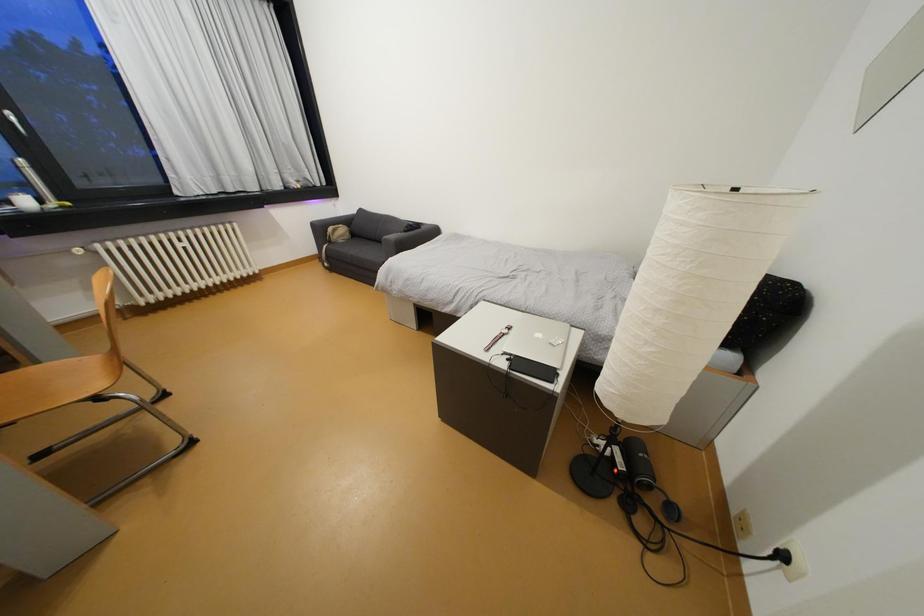
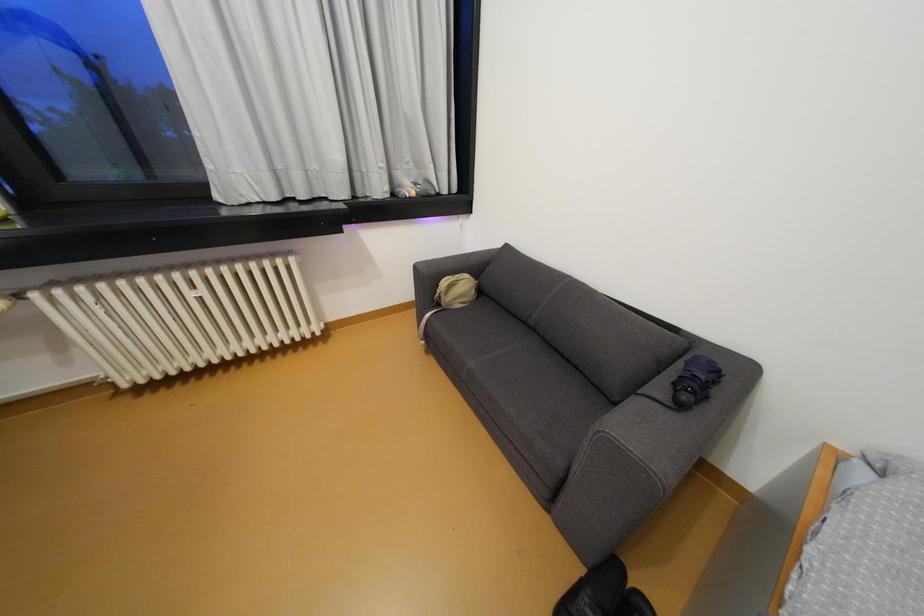
Looking at this image, in a continuous first-person perspective shot, in which direction is the camera moving?

The cameraman walked toward left, forward.